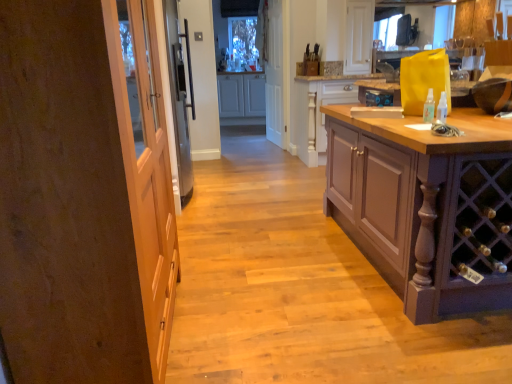
Image resolution: width=512 pixels, height=384 pixels. What do you see at coordinates (429, 107) in the screenshot?
I see `clear plastic spray bottle at right` at bounding box center [429, 107].

Measure the distance between point (286,134) and camera.

The depth of point (286,134) is 5.07 meters.

Locate an element on the screen. This screenshot has height=384, width=512. white matte screen door at center is located at coordinates (277, 73).

The height and width of the screenshot is (384, 512). What are the coordinates of `white matte cabinet at center, the third cabinetry positioned from the front` in the screenshot? It's located at (241, 95).

This screenshot has height=384, width=512. What do you see at coordinates (241, 95) in the screenshot?
I see `white matte cabinet at center, the first cabinetry when ordered from back to front` at bounding box center [241, 95].

Where is `wooden door at left`? wooden door at left is located at coordinates (83, 196).

Is wooden door at left at the right side of pale wood cabinet at center, which is counted as the second cabinetry, starting from the back?

Incorrect, wooden door at left is not on the right side of pale wood cabinet at center, which is counted as the second cabinetry, starting from the back.

From the image's perspective, which cabinetry is the 2nd one above the wooden door at left? Please provide its 2D coordinates.

[(319, 110)]

Is wooden door at left completely or partially outside of pale wood cabinet at center, the 2th cabinetry viewed from the front?

wooden door at left lies outside pale wood cabinet at center, the 2th cabinetry viewed from the front,'s area.

Can you tell me how much pale wood cabinet at center, the 2th cabinetry viewed from the front, and wooden door at left differ in facing direction?

90.7 degrees separate the facing orientations of pale wood cabinet at center, the 2th cabinetry viewed from the front, and wooden door at left.

From a real-world perspective, is pale wood cabinet at center, the 2th cabinetry viewed from the front, on wooden door at left?

No, from a real-world perspective, pale wood cabinet at center, the 2th cabinetry viewed from the front, is not on top of wooden door at left.

From the image's perspective, is pale wood cabinet at center, the 2th cabinetry viewed from the front, located above wooden door at left?

Yes, from the image's perspective, pale wood cabinet at center, the 2th cabinetry viewed from the front, is over wooden door at left.

Is purple wood cabinet at right, placed as the 3th cabinetry when sorted from back to front, in contact with white matte screen door at center?

There is a gap between purple wood cabinet at right, placed as the 3th cabinetry when sorted from back to front, and white matte screen door at center.

Considering the positions of points (477, 163) and (273, 39), is point (477, 163) farther from camera compared to point (273, 39)?

No, (477, 163) is in front of (273, 39).

Which point is more distant from viewer, (162, 133) or (286, 147)?

The point (286, 147) is farther.

Are wooden door at left and white matte screen door at center beside each other?

No, wooden door at left is not next to white matte screen door at center.

Looking at this image, is wooden door at left taller than white matte screen door at center?

No.

How different are the orientations of wooden door at left and white matte screen door at center in degrees?

174 degrees.

Which object is wider, white matte cabinet at center, the third cabinetry positioned from the front, or purple wood cabinet at right, which ranks as the 1th cabinetry in front-to-back order?

purple wood cabinet at right, which ranks as the 1th cabinetry in front-to-back order.

Which of these two, white matte cabinet at center, the third cabinetry positioned from the front, or purple wood cabinet at right, which ranks as the 1th cabinetry in front-to-back order, stands shorter?

white matte cabinet at center, the third cabinetry positioned from the front.

Does point (219, 78) lie in front of point (406, 223)?

No, it is not.

Is white matte cabinet at center, the third cabinetry positioned from the front, closer to the viewer compared to purple wood cabinet at right, which ranks as the 1th cabinetry in front-to-back order?

No, white matte cabinet at center, the third cabinetry positioned from the front, is further to the viewer.

Which object is thinner, white matte screen door at center or pale wood cabinet at center, the 2th cabinetry viewed from the front?

white matte screen door at center.

From a real-world perspective, is white matte screen door at center positioned above or below pale wood cabinet at center, the 2th cabinetry viewed from the front?

white matte screen door at center is situated higher than pale wood cabinet at center, the 2th cabinetry viewed from the front, in the real world.

Is point (268, 32) positioned behind point (296, 140)?

Yes, point (268, 32) is behind point (296, 140).

Considering the relative positions of white matte screen door at center and pale wood cabinet at center, the 2th cabinetry viewed from the front, in the image provided, is white matte screen door at center in front of pale wood cabinet at center, the 2th cabinetry viewed from the front,?

No, white matte screen door at center is behind pale wood cabinet at center, the 2th cabinetry viewed from the front.

What's the angular difference between purple wood cabinet at right, which ranks as the 1th cabinetry in front-to-back order, and clear plastic spray bottle at right's facing directions?

The angle between the facing direction of purple wood cabinet at right, which ranks as the 1th cabinetry in front-to-back order, and the facing direction of clear plastic spray bottle at right is 1.08 degrees.

Between purple wood cabinet at right, placed as the 3th cabinetry when sorted from back to front, and clear plastic spray bottle at right, which one has more height?

purple wood cabinet at right, placed as the 3th cabinetry when sorted from back to front, is taller.

Between point (479, 146) and point (430, 113), which one is positioned in front?

Point (479, 146)

Is purple wood cabinet at right, placed as the 3th cabinetry when sorted from back to front, in front of or behind clear plastic spray bottle at right in the image?

purple wood cabinet at right, placed as the 3th cabinetry when sorted from back to front, is positioned closer to the viewer than clear plastic spray bottle at right.

Identify the location of door below the pale wood cabinet at center, which is counted as the second cabinetry, starting from the back (from the image's perspective). This screenshot has width=512, height=384. (83, 196).

Image resolution: width=512 pixels, height=384 pixels. In order to click on the 3rd cabinetry below the wooden door at left (from a real-world perspective) in this screenshot , I will do `click(319, 110)`.

Which object lies nearer to the anchor point white matte cabinet at center, the first cabinetry when ordered from back to front, pale wood cabinet at center, the 2th cabinetry viewed from the front, or white matte screen door at center?

Based on the image, white matte screen door at center appears to be nearer to white matte cabinet at center, the first cabinetry when ordered from back to front.

Estimate the real-world distances between objects in this image. Which object is further from purple wood cabinet at right, placed as the 3th cabinetry when sorted from back to front, white matte cabinet at center, the third cabinetry positioned from the front, or wooden door at left?

Based on the image, white matte cabinet at center, the third cabinetry positioned from the front, appears to be further to purple wood cabinet at right, placed as the 3th cabinetry when sorted from back to front.

Considering their positions, is pale wood cabinet at center, the 2th cabinetry viewed from the front, positioned further to white matte screen door at center than clear plastic spray bottle at right?

The object further to white matte screen door at center is clear plastic spray bottle at right.

When comparing their distances from purple wood cabinet at right, which ranks as the 1th cabinetry in front-to-back order, does pale wood cabinet at center, the 2th cabinetry viewed from the front, or white matte screen door at center seem further?

Among the two, white matte screen door at center is located further to purple wood cabinet at right, which ranks as the 1th cabinetry in front-to-back order.

Considering their positions, is wooden door at left positioned further to clear plastic spray bottle at right than purple wood cabinet at right, placed as the 3th cabinetry when sorted from back to front?

Among the two, wooden door at left is located further to clear plastic spray bottle at right.

When comparing their distances from white matte screen door at center, does purple wood cabinet at right, which ranks as the 1th cabinetry in front-to-back order, or wooden door at left seem closer?

Based on the image, purple wood cabinet at right, which ranks as the 1th cabinetry in front-to-back order, appears to be nearer to white matte screen door at center.

Which object lies further to the anchor point white matte screen door at center, white matte cabinet at center, the first cabinetry when ordered from back to front, or purple wood cabinet at right, which ranks as the 1th cabinetry in front-to-back order?

purple wood cabinet at right, which ranks as the 1th cabinetry in front-to-back order.

From the image, which object appears to be farther from clear plastic spray bottle at right, pale wood cabinet at center, which is counted as the second cabinetry, starting from the back, or white matte cabinet at center, the first cabinetry when ordered from back to front?

The object further to clear plastic spray bottle at right is white matte cabinet at center, the first cabinetry when ordered from back to front.

You are a GUI agent. You are given a task and a screenshot of the screen. Output one action in this format:
    pyautogui.click(x=<x>, y=<y>)
    Task: Click on the screen door located between pale wood cabinet at center, the 2th cabinetry viewed from the front, and white matte cabinet at center, the third cabinetry positioned from the front, in the depth direction
    Image resolution: width=512 pixels, height=384 pixels.
    Given the screenshot: What is the action you would take?
    pyautogui.click(x=277, y=73)

Where is `bottle located between purple wood cabinet at right, which ranks as the 1th cabinetry in front-to-back order, and white matte screen door at center in the depth direction`? This screenshot has width=512, height=384. bottle located between purple wood cabinet at right, which ranks as the 1th cabinetry in front-to-back order, and white matte screen door at center in the depth direction is located at coordinates (429, 107).

At what (x,y) coordinates should I click in order to perform the action: click on bottle located between purple wood cabinet at right, placed as the 3th cabinetry when sorted from back to front, and pale wood cabinet at center, the 2th cabinetry viewed from the front, in the depth direction. Please return your answer as a coordinate pair (x, y). The width and height of the screenshot is (512, 384). Looking at the image, I should click on (429, 107).

Where is `screen door positioned between wooden door at left and white matte cabinet at center, the third cabinetry positioned from the front, from near to far`? This screenshot has width=512, height=384. screen door positioned between wooden door at left and white matte cabinet at center, the third cabinetry positioned from the front, from near to far is located at coordinates (277, 73).